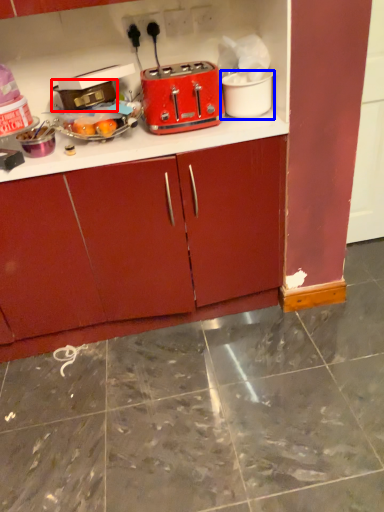
Question: Which object is further to the camera taking this photo, appliance (highlighted by a red box) or appliance (highlighted by a blue box)?

Choices:
 (A) appliance
 (B) appliance

Answer: (B)